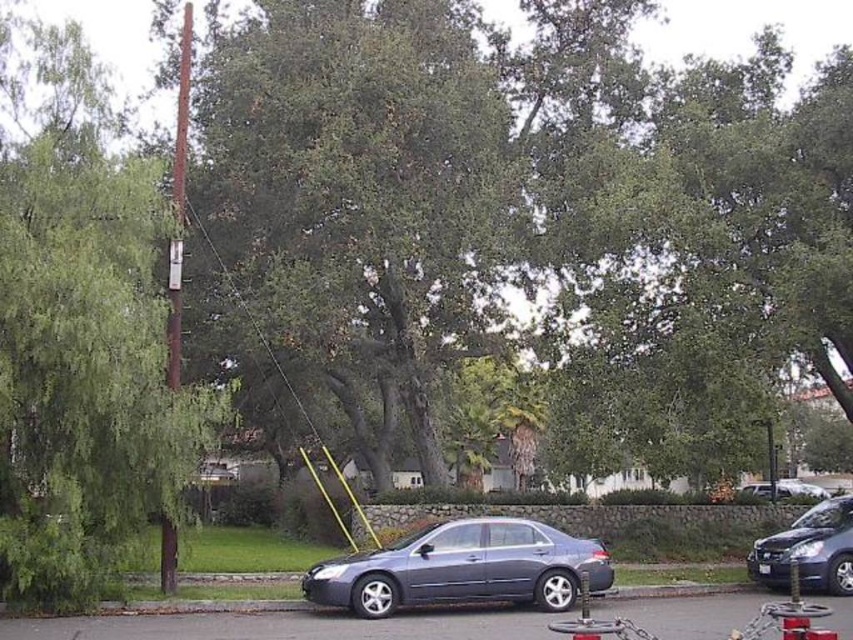
Question: Which of the following is the farthest from the observer?

Choices:
 (A) click(178, 136)
 (B) click(792, 483)
 (C) click(410, 536)
 (D) click(370, 525)

Answer: (B)

Question: Can you confirm if matte black sedan at right is positioned above metallic silver sedan at center?

Choices:
 (A) yes
 (B) no

Answer: (A)

Question: Does green leafy tree at left appear under metallic silver sedan at center?

Choices:
 (A) yes
 (B) no

Answer: (B)

Question: Which object is positioned farthest from the satin gray sedan at center?

Choices:
 (A) green leafy tree at upper center
 (B) metallic silver sedan at center
 (C) matte black sedan at right
 (D) brown wooden telegraph pole at left

Answer: (B)

Question: Can you confirm if satin gray sedan at center is positioned below matte black sedan at right?

Choices:
 (A) yes
 (B) no

Answer: (B)

Question: Among these points, which one is farthest from the camera?

Choices:
 (A) (335, 468)
 (B) (9, 216)
 (C) (316, 588)
 (D) (807, 483)

Answer: (D)